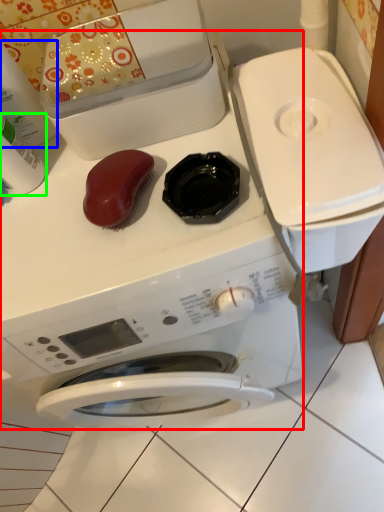
Question: Based on their relative distances, which object is nearer to washing machine (highlighted by a red box)? Choose from cleaning product (highlighted by a blue box) and cleaning product (highlighted by a green box).

Choices:
 (A) cleaning product
 (B) cleaning product

Answer: (B)